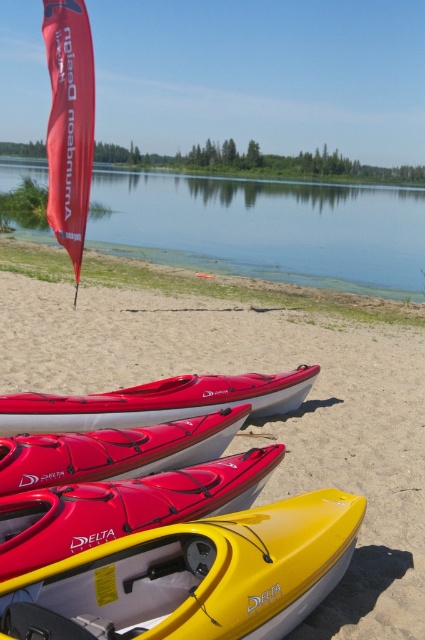
You are standing at the point with coordinates point (33, 352) and want to walk to the point with coordinates point (82, 470). Will you be moving towards the kayaks or away from them?

Since point (33, 352) is behind point (82, 470), moving from point (33, 352) to point (82, 470) means you are moving towards the kayaks.

You are planning to take a photo of the yellow matte kayak at lower center and the transparent water at center. Which object will appear smaller in the photo?

The yellow matte kayak at lower center occupies less space than transparent water at center, so it will appear smaller in the photo.